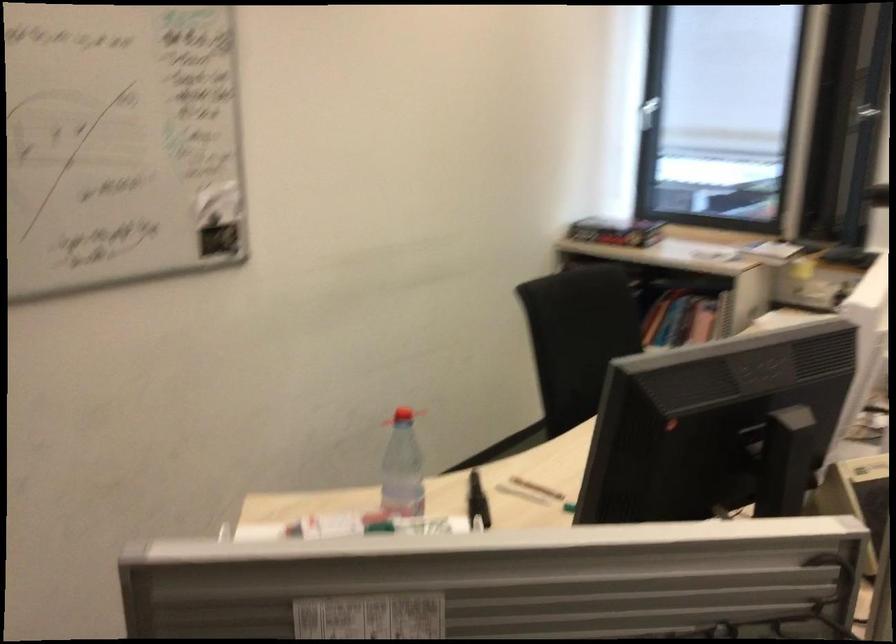
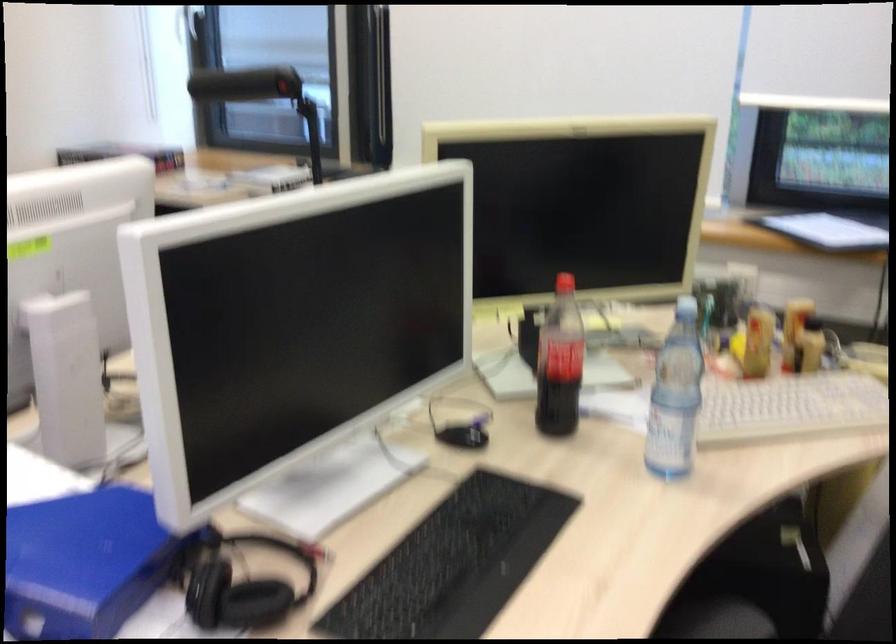
Question: Which direction would the cameraman need to move to produce the second image? Reply with the corresponding letter.

Choices:
 (A) Left
 (B) Right
 (C) Forward
 (D) Backward

Answer: (B)